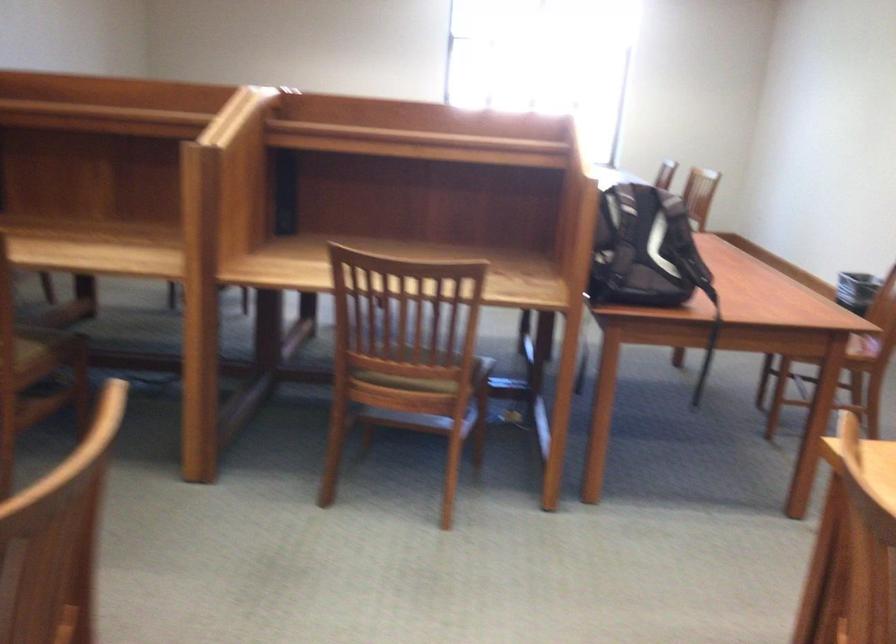
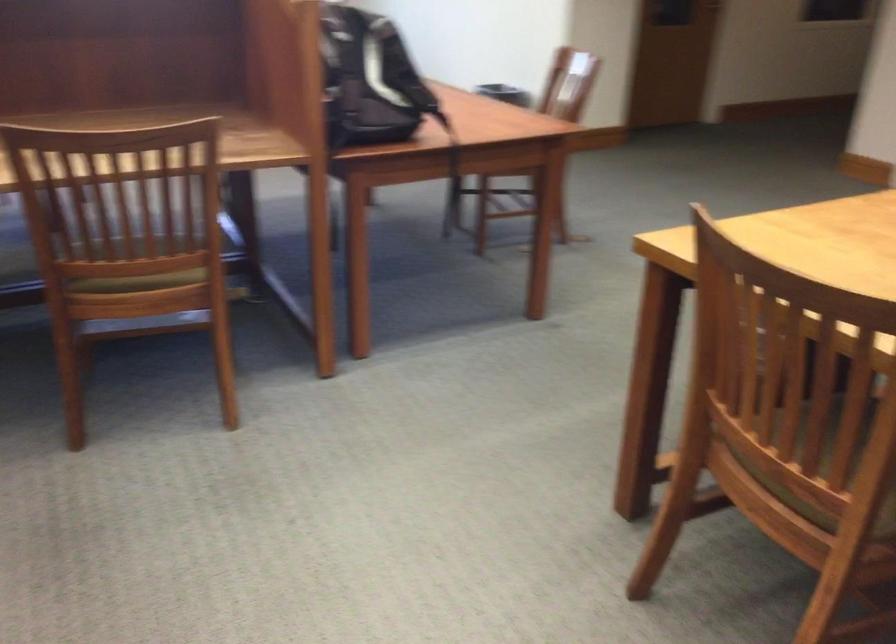
Question: I am providing you with two images of the same scene from different viewpoints. After the viewpoint changes to image2, which objects are now occluded?

Choices:
 (A) chair sitting surface
 (B) black backpack
 (C) black trash can
 (D) none of these

Answer: (D)